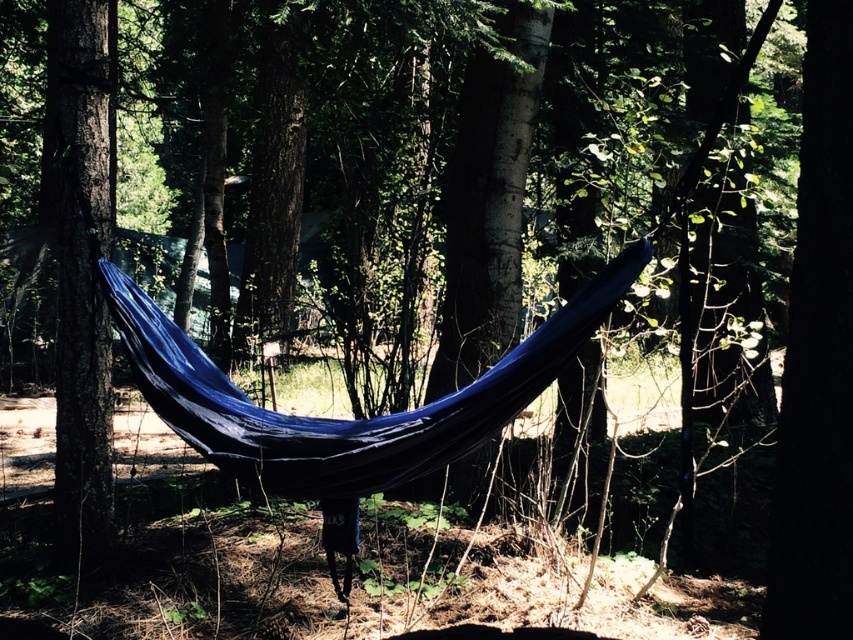
Between dark brown wood at center and dark brown wood tree at left, which one has more height?

Standing taller between the two is dark brown wood tree at left.

Does dark brown wood at center have a greater width compared to dark brown wood tree at left?

No.

Who is more forward, (x=837, y=472) or (x=65, y=348)?

Point (x=837, y=472)

At what (x,y) coordinates should I click in order to perform the action: click on dark brown wood at center. Please return your answer as a coordinate pair (x, y). Looking at the image, I should click on (817, 356).

Does blue fabric hammock at center come in front of dark brown wood tree at left?

Yes, it is.

Can you confirm if blue fabric hammock at center is thinner than dark brown wood tree at left?

No, blue fabric hammock at center is not thinner than dark brown wood tree at left.

Does point (397, 445) lie behind point (91, 472)?

No, (397, 445) is in front of (91, 472).

Locate an element on the screen. The width and height of the screenshot is (853, 640). blue fabric hammock at center is located at coordinates (345, 419).

Is dark brown wood at center smaller than blue fabric hammock at center?

Correct, dark brown wood at center occupies less space than blue fabric hammock at center.

Does dark brown wood at center have a greater height compared to blue fabric hammock at center?

Indeed, dark brown wood at center has a greater height compared to blue fabric hammock at center.

Is point (843, 294) less distant than point (537, 353)?

Yes, it is.

You are a GUI agent. You are given a task and a screenshot of the screen. Output one action in this format:
    pyautogui.click(x=<x>, y=<y>)
    Task: Click on the dark brown wood at center
    
    Given the screenshot: What is the action you would take?
    pyautogui.click(x=817, y=356)